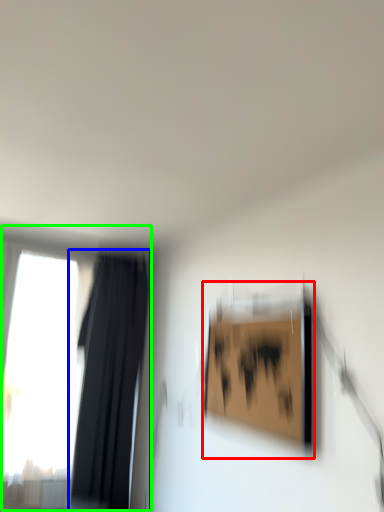
Question: Which object is positioned farthest from picture frame (highlighted by a red box)? Select from curtain (highlighted by a blue box) and window (highlighted by a green box).

Choices:
 (A) curtain
 (B) window

Answer: (B)